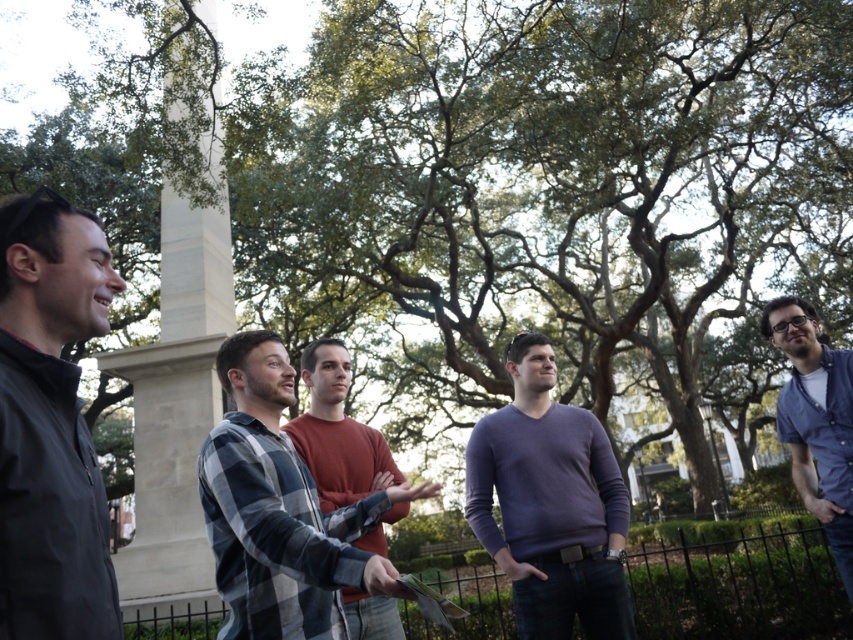
Question: Which point appears farthest from the camera in this image?

Choices:
 (A) (383, 576)
 (B) (538, 412)

Answer: (B)

Question: Can you confirm if light gray stone pillar at left is smaller than purple sweater at center?

Choices:
 (A) no
 (B) yes

Answer: (A)

Question: Which of the following is the closest to the observer?

Choices:
 (A) (764, 333)
 (B) (177, 417)

Answer: (A)

Question: Does dark gray jacket at left have a larger size compared to light gray stone pillar at left?

Choices:
 (A) yes
 (B) no

Answer: (B)

Question: Is light gray stone pillar at left below blue button-up shirt at right?

Choices:
 (A) no
 (B) yes

Answer: (B)

Question: Which point is closer to the camera?

Choices:
 (A) (543, 353)
 (B) (286, 547)
 (C) (38, 326)

Answer: (C)